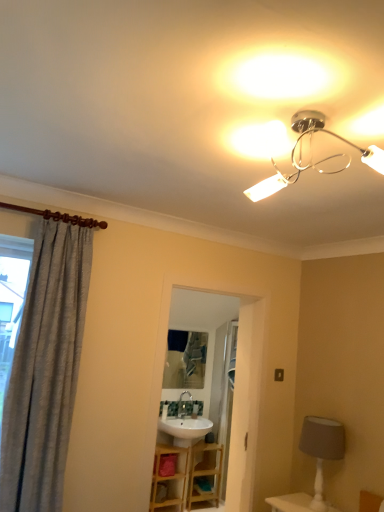
Question: From the image's perspective, is white textured table lamp at lower right located above or below metallic reflective mirror at center?

Choices:
 (A) above
 (B) below

Answer: (B)

Question: In terms of width, does white textured table lamp at lower right look wider or thinner when compared to metallic reflective mirror at center?

Choices:
 (A) thin
 (B) wide

Answer: (B)

Question: Considering the real-world distances, which object is farthest from the wooden vanity at center?

Choices:
 (A) metallic reflective mirror at center
 (B) white textured table lamp at lower right
 (C) gray textured curtain at left

Answer: (C)

Question: Estimate the real-world distances between objects in this image. Which object is closer to the wooden vanity at center?

Choices:
 (A) metallic reflective mirror at center
 (B) white textured table lamp at lower right
 (C) gray textured curtain at left

Answer: (A)